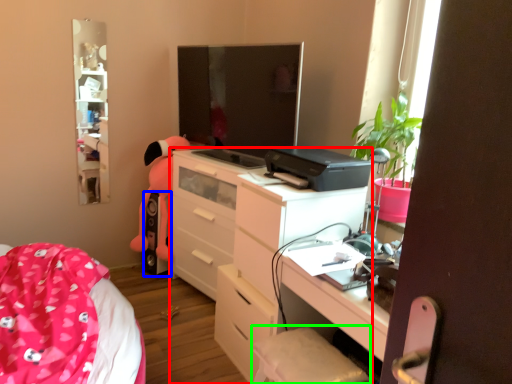
Question: Which object is positioned closest to chest of drawers (highlighted by a red box)? Select from speaker (highlighted by a blue box) and swivel chair (highlighted by a green box).

Choices:
 (A) speaker
 (B) swivel chair

Answer: (B)